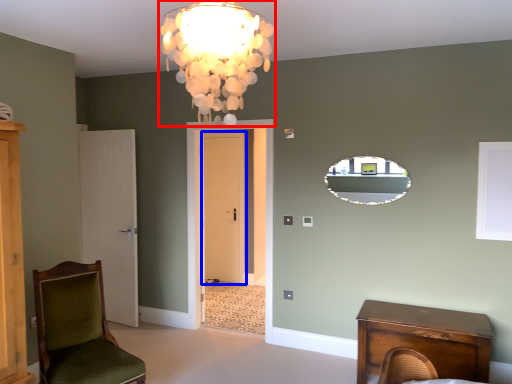
Question: Among these objects, which one is nearest to the camera, lamp (highlighted by a red box) or door (highlighted by a blue box)?

Choices:
 (A) lamp
 (B) door

Answer: (A)